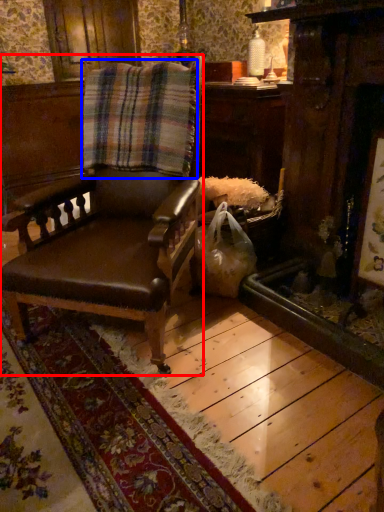
Question: Among these objects, which one is nearest to the camera, chair (highlighted by a red box) or blanket (highlighted by a blue box)?

Choices:
 (A) chair
 (B) blanket

Answer: (A)